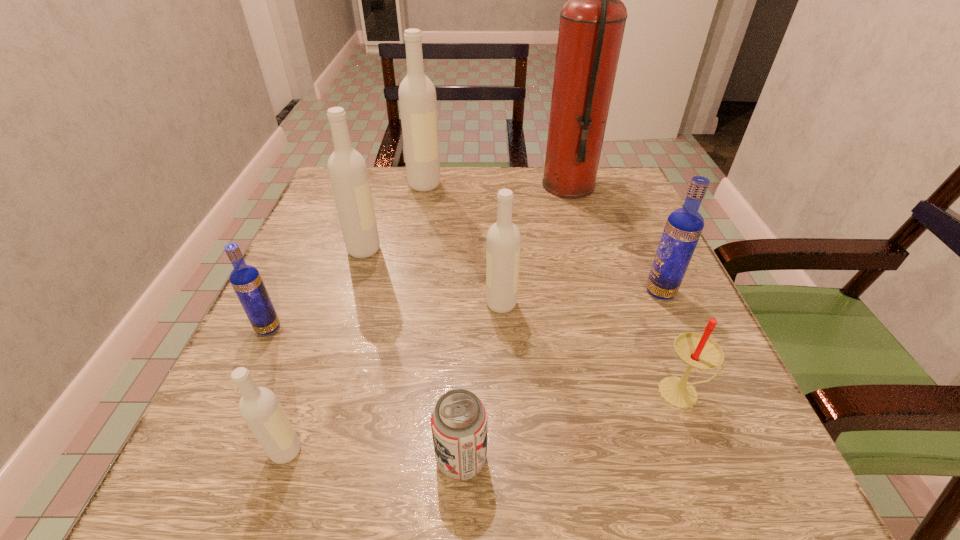
In the image, there is a desktop. Find the location of `free space at the right edge`. free space at the right edge is located at coordinates (605, 280).

Where is `vacant region at the near left corner of the desktop`? Image resolution: width=960 pixels, height=540 pixels. vacant region at the near left corner of the desktop is located at coordinates (222, 448).

I want to click on vacant space at the far right corner of the desktop, so click(599, 199).

In the image, there is a desktop. Where is `free space at the near right corner`? The width and height of the screenshot is (960, 540). free space at the near right corner is located at coordinates (756, 476).

At what (x,y) coordinates should I click in order to perform the action: click on free space between the shortest object and the smallest white vodka. Please return your answer as a coordinate pair (x, y). The height and width of the screenshot is (540, 960). Looking at the image, I should click on (373, 455).

This screenshot has width=960, height=540. Find the location of `empty location between the candle and the second vodka from right to left`. empty location between the candle and the second vodka from right to left is located at coordinates (592, 348).

At what (x,y) coordinates should I click in order to perform the action: click on empty location between the beer can and the second vodka from right to left. Please return your answer as a coordinate pair (x, y). The width and height of the screenshot is (960, 540). Looking at the image, I should click on (481, 381).

At what (x,y) coordinates should I click in order to perform the action: click on vacant area that lies between the fifth nearest vodka and the tallest vodka. Please return your answer as a coordinate pair (x, y). Looking at the image, I should click on (395, 217).

The width and height of the screenshot is (960, 540). Identify the location of unoccupied position between the third farthest white vodka and the fire extinguisher. (535, 245).

I want to click on blank region between the nearest white vodka and the rightmost vodka, so click(473, 372).